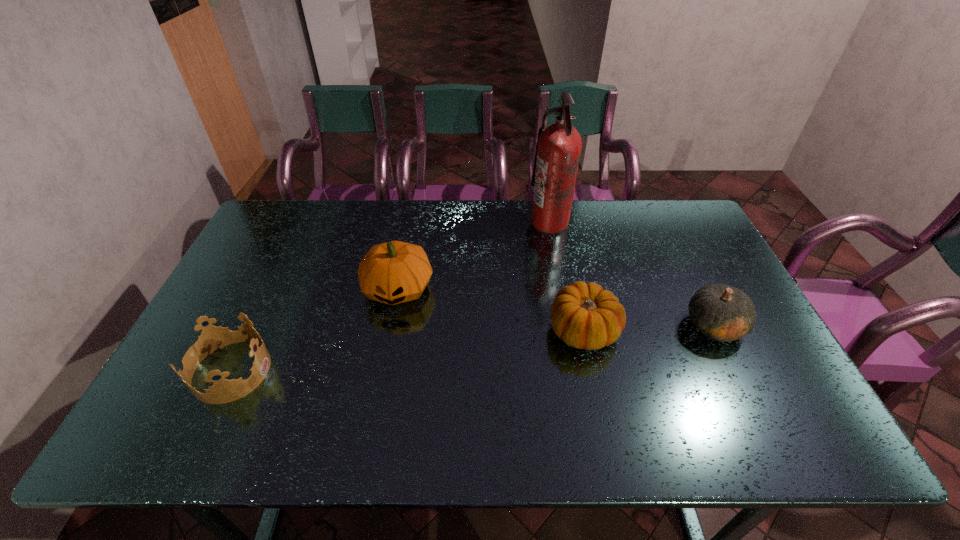
At what (x,y) coordinates should I click in order to perform the action: click on free spot that satisfies the following two spatial constraints: 1. on the side of the second gourd from left to right with the carved face; 2. on the left side of the second object from left to right. Please return your answer as a coordinate pair (x, y). This screenshot has height=540, width=960. Looking at the image, I should click on (390, 330).

Find the location of `vacant region that satisfies the following two spatial constraints: 1. on the side of the second gourd from right to left with the carved face; 2. on the left side of the fourth object from right to left`. vacant region that satisfies the following two spatial constraints: 1. on the side of the second gourd from right to left with the carved face; 2. on the left side of the fourth object from right to left is located at coordinates (390, 330).